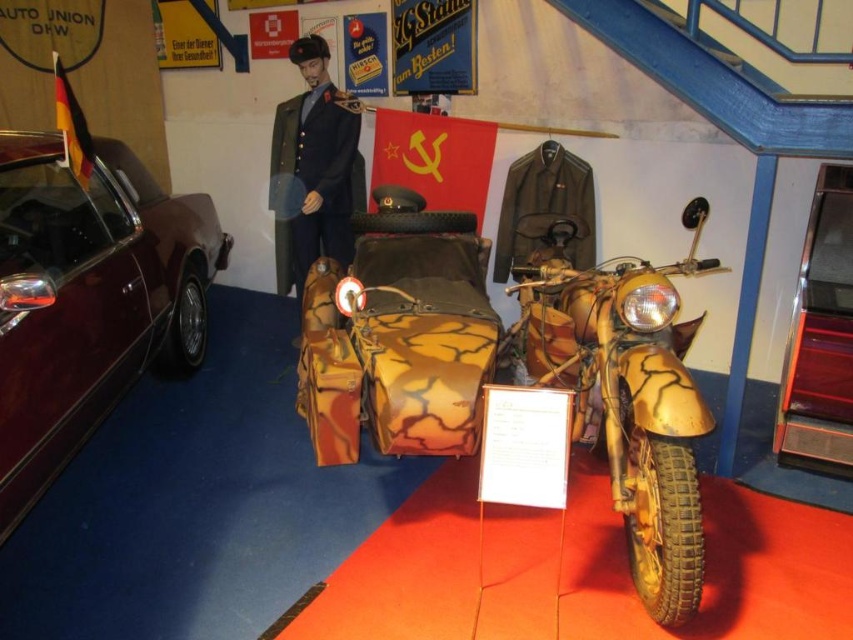
Question: Among these points, which one is nearest to the camera?

Choices:
 (A) (328, 157)
 (B) (199, 342)

Answer: (A)

Question: Which point is farther to the camera?

Choices:
 (A) matte black jacket at upper center
 (B) camouflage paint motorcycle at center
 (C) dark blue uniform at center

Answer: (A)

Question: Does camouflage paint motorcycle at center have a larger size compared to dark blue uniform at center?

Choices:
 (A) no
 (B) yes

Answer: (B)

Question: Can you confirm if glossy maroon car at left is bigger than matte black jacket at upper center?

Choices:
 (A) no
 (B) yes

Answer: (B)

Question: Which of these objects is positioned closest to the matte black jacket at upper center?

Choices:
 (A) camouflage paint motorcycle at center
 (B) dark blue uniform at center

Answer: (A)

Question: Does camouflage fabric sidecar at center have a greater width compared to dark blue uniform at center?

Choices:
 (A) no
 (B) yes

Answer: (B)